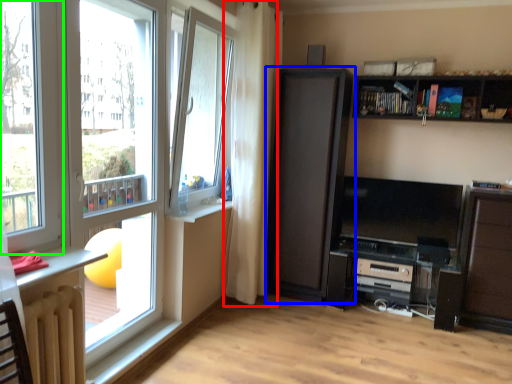
Question: Estimate the real-world distances between objects in this image. Which object is farther from curtain (highlighted by a red box), cupboard (highlighted by a blue box) or window (highlighted by a green box)?

Choices:
 (A) cupboard
 (B) window

Answer: (B)